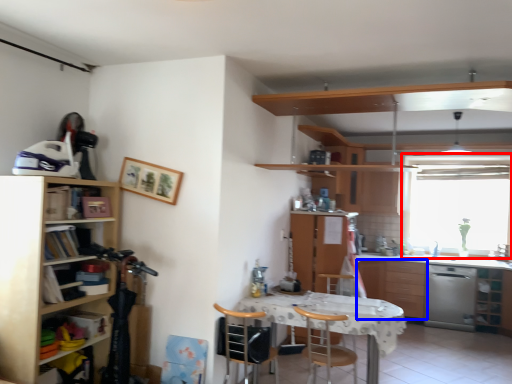
Question: Which object is closer to the camera taking this photo, window (highlighted by a red box) or cabinetry (highlighted by a blue box)?

Choices:
 (A) window
 (B) cabinetry

Answer: (B)